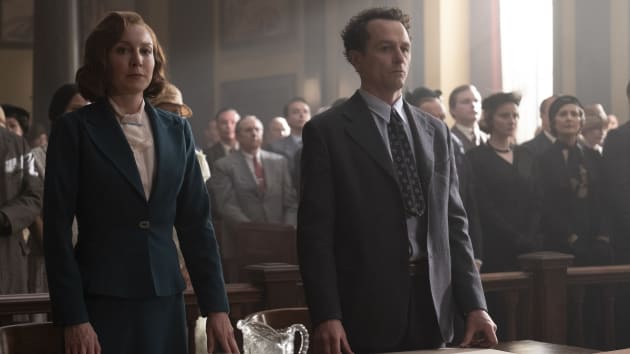
In order to click on wooden table in this screenshot , I will do `click(520, 350)`.